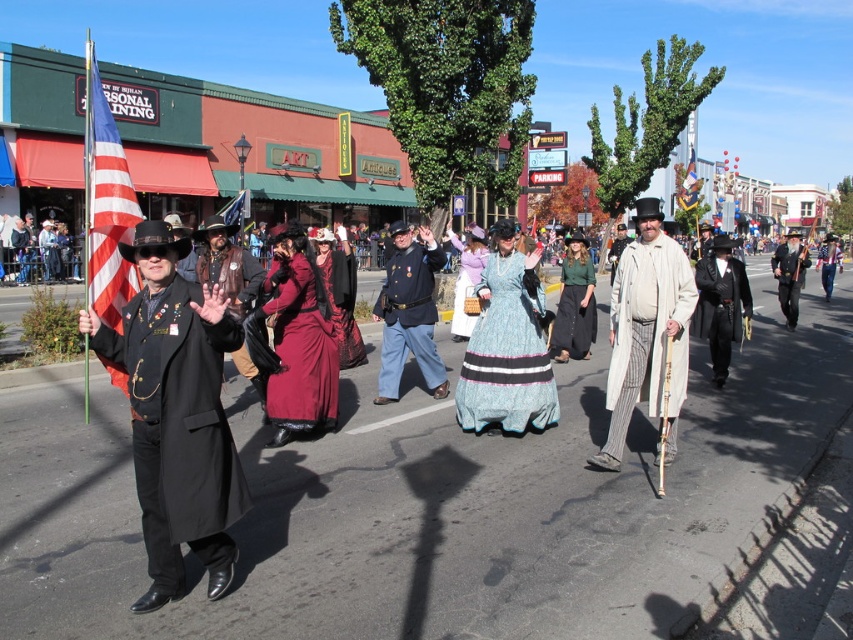
Question: Does blue textured fabric dress at center have a greater width compared to red velvet hat at center?

Choices:
 (A) no
 (B) yes

Answer: (A)

Question: Which object is closer to the camera taking this photo?

Choices:
 (A) leather glove at center
 (B) white textured coat at center
 (C) matte black coat at left

Answer: (C)

Question: Does blue denim pants at center have a greater width compared to matte blue flag at center?

Choices:
 (A) no
 (B) yes

Answer: (A)

Question: Which object appears farthest from the camera in this image?

Choices:
 (A) american flag at left
 (B) white textured coat at center

Answer: (B)

Question: Does burgundy satin dress at center have a lesser width compared to teal satin dress at center?

Choices:
 (A) yes
 (B) no

Answer: (A)

Question: Which point appears farthest from the camera in this image?

Choices:
 (A) (108, 156)
 (B) (312, 419)
 (C) (651, 376)
 (D) (169, 339)

Answer: (B)